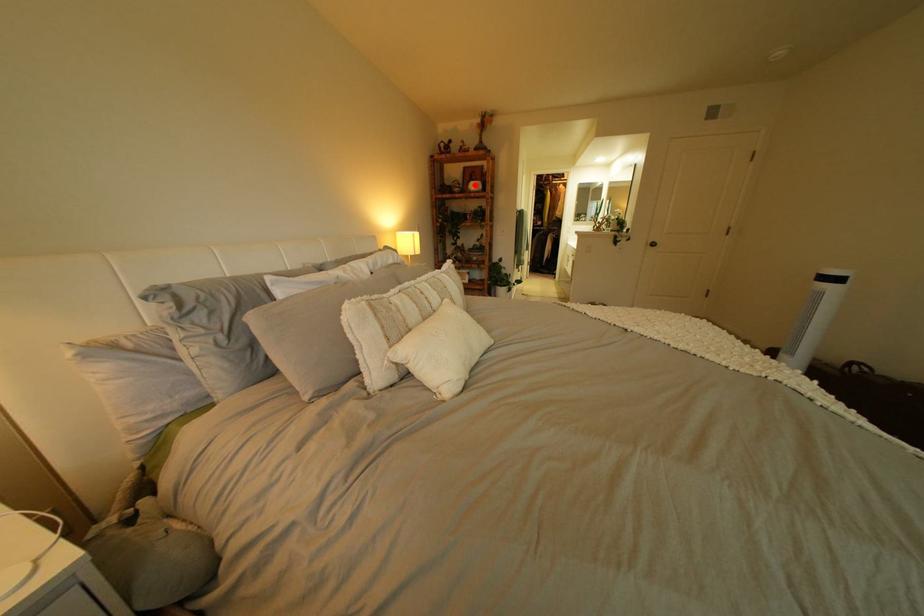
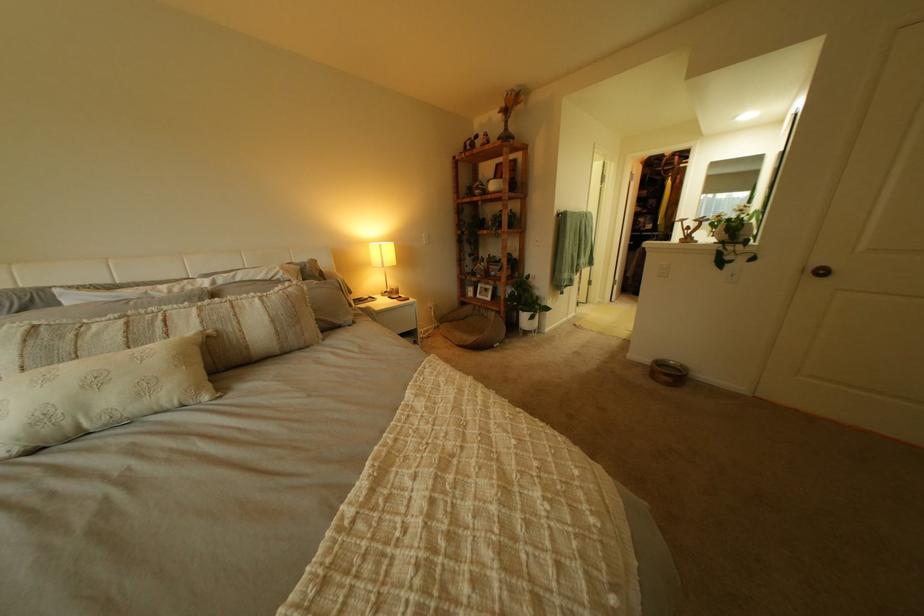
The point at the highlighted location is marked in the first image. Where is the corresponding point in the second image?

(497, 185)